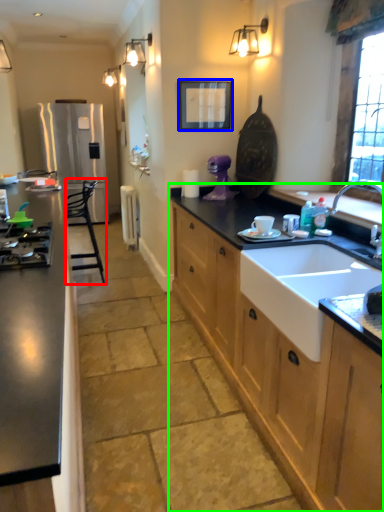
Question: Which is farther away from chair (highlighted by a red box)? picture frame (highlighted by a blue box) or cabinetry (highlighted by a green box)?

Choices:
 (A) picture frame
 (B) cabinetry

Answer: (B)